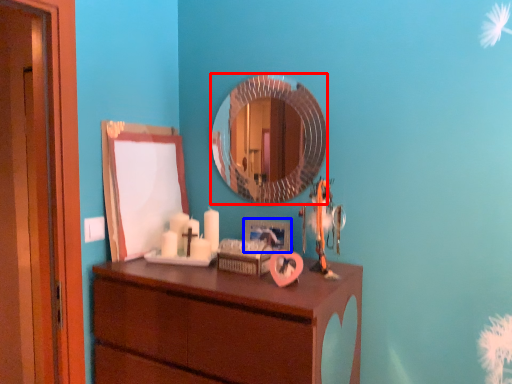
Question: Which object appears closest to the camera in this image, mirror (highlighted by a red box) or picture frame (highlighted by a blue box)?

Choices:
 (A) mirror
 (B) picture frame

Answer: (A)